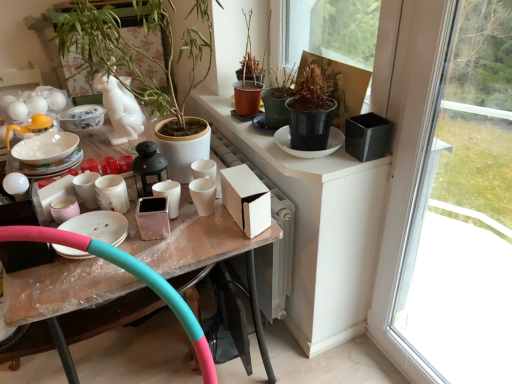
The width and height of the screenshot is (512, 384). Find the location of `free point in front of matte pink plate at lower left, the third tableware viewed from the right`. free point in front of matte pink plate at lower left, the third tableware viewed from the right is located at coordinates (70, 284).